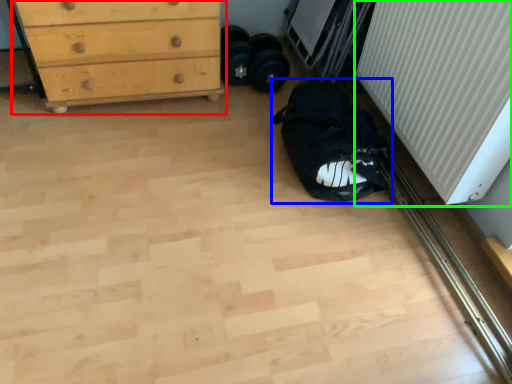
Question: Which is nearer to the chest of drawers (highlighted by a red box)? sleeping bag (highlighted by a blue box) or radiator (highlighted by a green box).

Choices:
 (A) sleeping bag
 (B) radiator

Answer: (A)